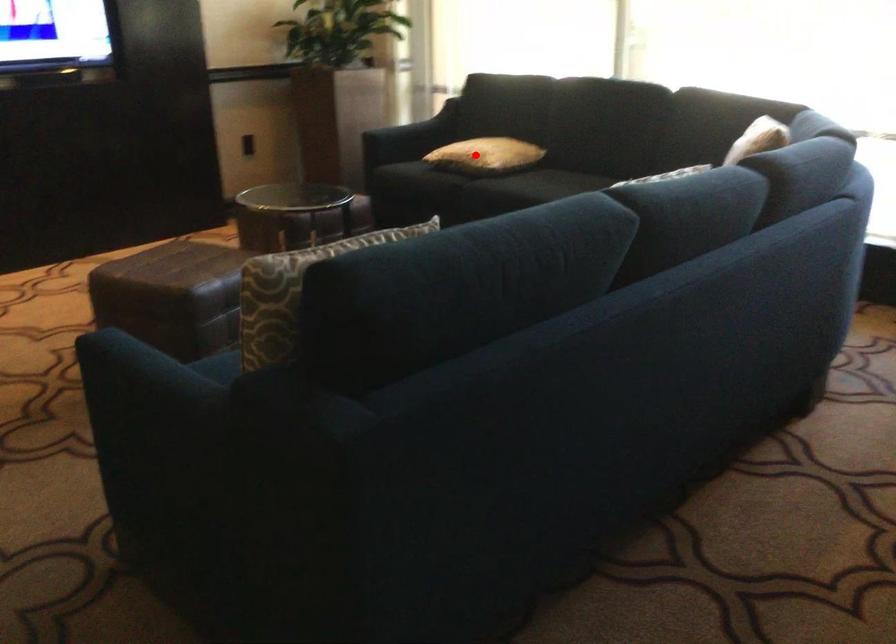
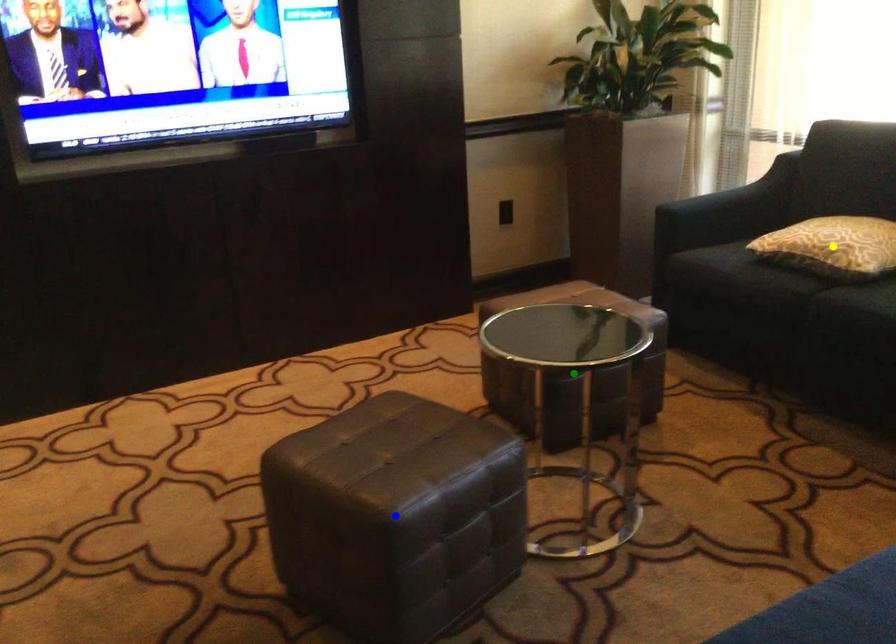
Question: I am providing you with two images of the same scene from different viewpoints. A red point is marked on the first image. You are given multiple points on the second image. Which point in image 2 represents the same 3d spot as the red point in image 1?

Choices:
 (A) yellow point
 (B) blue point
 (C) green point

Answer: (A)